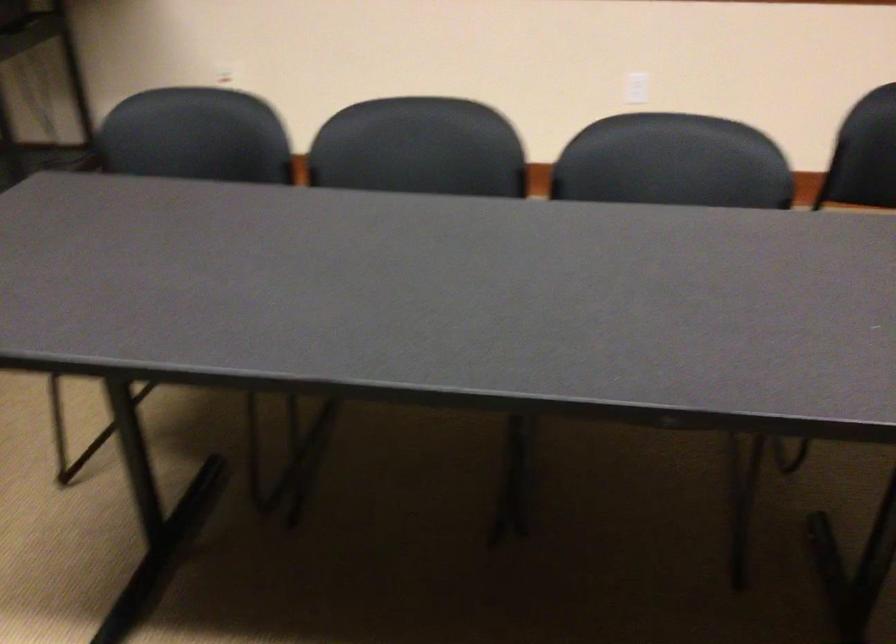
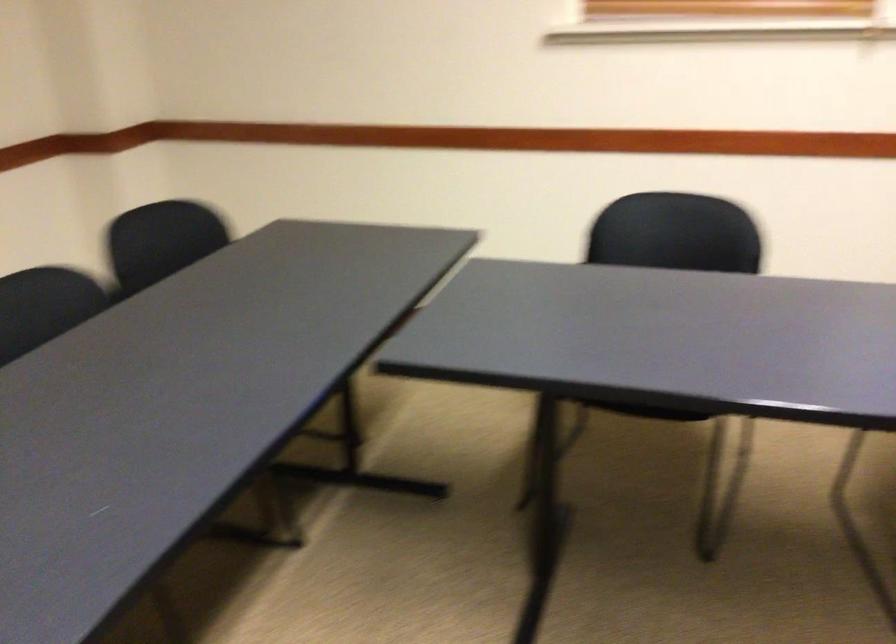
The images are taken continuously from a first-person perspective. In which direction is your viewpoint rotating?

The rotation direction of the camera is left-down.